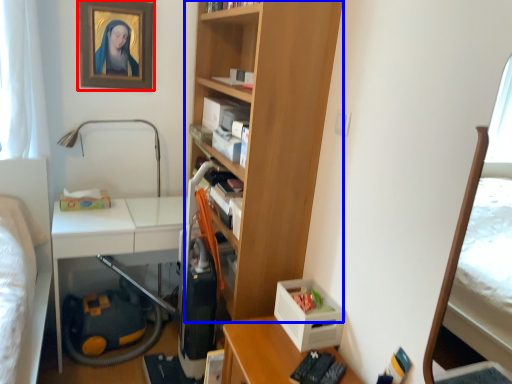
Question: Which point is closer to the camera, picture frame (highlighted by a red box) or bookcase (highlighted by a blue box)?

Choices:
 (A) picture frame
 (B) bookcase

Answer: (B)